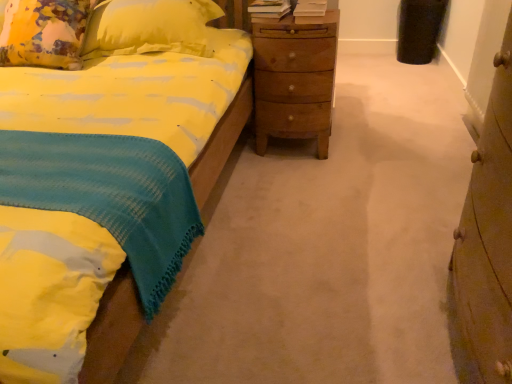
What do you see at coordinates (488, 237) in the screenshot?
I see `wooden chest of drawers at right` at bounding box center [488, 237].

This screenshot has width=512, height=384. Describe the element at coordinates (44, 33) in the screenshot. I see `yellow fabric pillow at upper left` at that location.

In order to face wooden nightstand at center, should I rotate leftwards or rightwards?

A 5.385 degree turn to the right will do.

Image resolution: width=512 pixels, height=384 pixels. Identify the location of wooden chest of drawers at right. (488, 237).

Which is more to the left, yellow fabric pillow at upper left or wooden chest of drawers at right?

yellow fabric pillow at upper left.

Is yellow fabric pillow at upper left further to camera compared to wooden chest of drawers at right?

Yes, yellow fabric pillow at upper left is behind wooden chest of drawers at right.

Is yellow fabric pillow at upper left facing towards wooden chest of drawers at right?

No.

Can you tell me how much yellow fabric pillow at upper left and wooden chest of drawers at right differ in facing direction?

yellow fabric pillow at upper left and wooden chest of drawers at right are facing 88.1 degrees away from each other.

From a real-world perspective, is wooden nightstand at center positioned under yellow fabric pillow at upper left based on gravity?

Yes, from a real-world perspective, wooden nightstand at center is beneath yellow fabric pillow at upper left.

Looking at their sizes, would you say wooden nightstand at center is wider or thinner than yellow fabric pillow at upper left?

wooden nightstand at center is thinner than yellow fabric pillow at upper left.

Which object is further away from the camera, wooden nightstand at center or yellow fabric pillow at upper left?

wooden nightstand at center is further from the camera.

From the image's perspective, is wooden nightstand at center located beneath yellow fabric pillow at upper left?

Yes.

In the scene shown: From the image's perspective, which is below, wooden chest of drawers at right or wooden nightstand at center?

wooden chest of drawers at right is shown below in the image.

Considering the positions of objects wooden chest of drawers at right and wooden nightstand at center in the image provided, who is more to the left, wooden chest of drawers at right or wooden nightstand at center?

wooden nightstand at center.

Is wooden chest of drawers at right aimed at wooden nightstand at center?

No.

Is wooden chest of drawers at right not within yellow fabric pillow at upper left?

Yes, wooden chest of drawers at right is located beyond the bounds of yellow fabric pillow at upper left.

Looking at this image, considering their positions, is wooden chest of drawers at right located in front of or behind yellow fabric pillow at upper left?

wooden chest of drawers at right is in front of yellow fabric pillow at upper left.

Does wooden chest of drawers at right have a greater height compared to yellow fabric pillow at upper left?

Indeed, wooden chest of drawers at right has a greater height compared to yellow fabric pillow at upper left.

Is wooden chest of drawers at right at the right side of yellow fabric pillow at upper left?

Indeed, wooden chest of drawers at right is positioned on the right side of yellow fabric pillow at upper left.

Which object is closer to the camera, wooden nightstand at center or wooden chest of drawers at right?

wooden chest of drawers at right is more forward.

From the image's perspective, is wooden nightstand at center below wooden chest of drawers at right?

No.

Which is less distant, (267, 52) or (496, 238)?

The point (496, 238) is in front.

Locate an element on the screen. Image resolution: width=512 pixels, height=384 pixels. chest of drawers in front of the wooden nightstand at center is located at coordinates (488, 237).

Is yellow fabric pillow at upper left taller than wooden nightstand at center?

Incorrect, the height of yellow fabric pillow at upper left is not larger of that of wooden nightstand at center.

Considering the sizes of yellow fabric pillow at upper left and wooden nightstand at center in the image, is yellow fabric pillow at upper left wider or thinner than wooden nightstand at center?

Clearly, yellow fabric pillow at upper left has more width compared to wooden nightstand at center.

How many degrees apart are the facing directions of yellow fabric pillow at upper left and wooden nightstand at center?

yellow fabric pillow at upper left and wooden nightstand at center are facing 0.634 degrees away from each other.

Identify the location of pillow to the left of wooden chest of drawers at right. (44, 33).

You are a GUI agent. You are given a task and a screenshot of the screen. Output one action in this format:
    pyautogui.click(x=<x>, y=<y>)
    Task: Click on the nightstand located underneath the yellow fabric pillow at upper left (from a real-world perspective)
    This screenshot has width=512, height=384.
    Given the screenshot: What is the action you would take?
    pyautogui.click(x=294, y=79)

Based on their spatial positions, is wooden chest of drawers at right or wooden nightstand at center further from yellow fabric pillow at upper left?

wooden chest of drawers at right is positioned further to the anchor yellow fabric pillow at upper left.

Which object lies nearer to the anchor point wooden nightstand at center, wooden chest of drawers at right or yellow fabric pillow at upper left?

yellow fabric pillow at upper left lies closer to wooden nightstand at center than the other object.

Estimate the real-world distances between objects in this image. Which object is closer to yellow fabric pillow at upper left, wooden nightstand at center or wooden chest of drawers at right?

wooden nightstand at center lies closer to yellow fabric pillow at upper left than the other object.

Considering their positions, is wooden nightstand at center positioned closer to wooden chest of drawers at right than yellow fabric pillow at upper left?

Among the two, wooden nightstand at center is located nearer to wooden chest of drawers at right.

Considering their positions, is yellow fabric pillow at upper left positioned further to wooden nightstand at center than wooden chest of drawers at right?

The object further to wooden nightstand at center is wooden chest of drawers at right.

Which object lies nearer to the anchor point wooden chest of drawers at right, yellow fabric pillow at upper left or wooden nightstand at center?

wooden nightstand at center is closer to wooden chest of drawers at right.

Where is `nightstand between yellow fabric pillow at upper left and wooden chest of drawers at right`? Image resolution: width=512 pixels, height=384 pixels. nightstand between yellow fabric pillow at upper left and wooden chest of drawers at right is located at coordinates (294, 79).